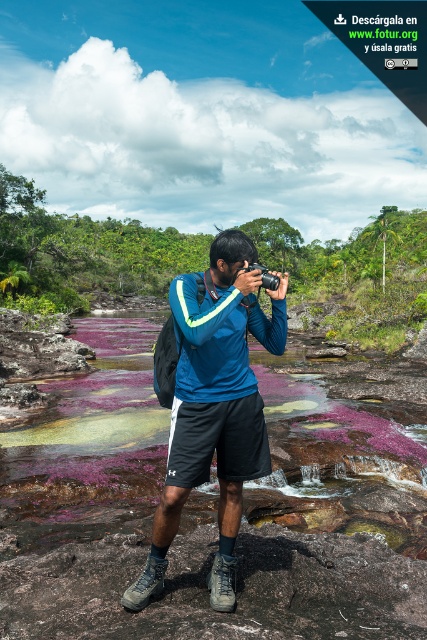
You are a photographer trying to capture the purple mossy rocks at center and the blue fabric shirt at center in the same frame. Which object should you zoom out to include both?

Since the purple mossy rocks at center are wider than the blue fabric shirt at center, you should zoom out enough to include the wider purple mossy rocks at center first, then adjust to ensure the blue fabric shirt at center is also in frame.

You are a photographer trying to capture the purple mossy rocks at center and the black plastic camera at center in your shot. Which object should you focus on first if you want to emphasize its size in the photo?

You should focus on the purple mossy rocks at center first because it is bigger than the black plastic camera at center, making it a more prominent subject in the photo.